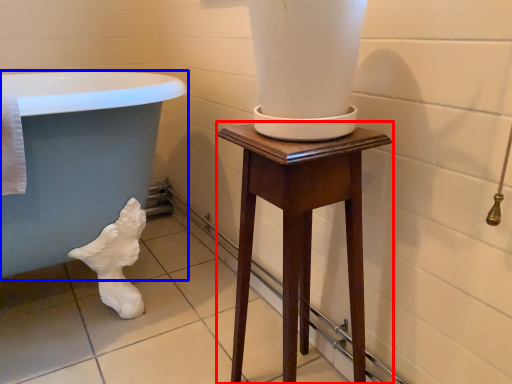
Question: Which object appears farthest to the camera in this image, furniture (highlighted by a red box) or bath (highlighted by a blue box)?

Choices:
 (A) furniture
 (B) bath

Answer: (B)